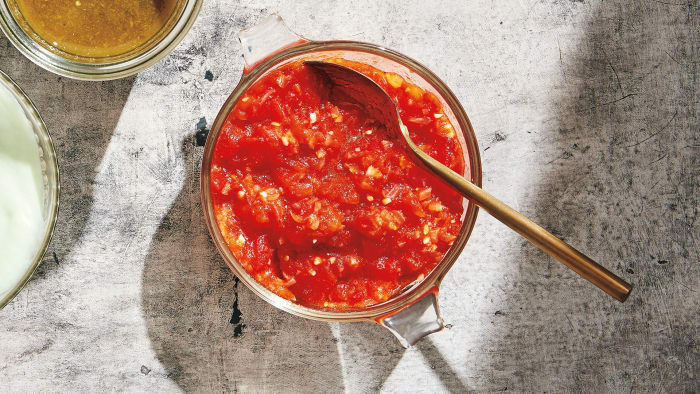
This screenshot has height=394, width=700. Identify the location of spoon. 392,151.